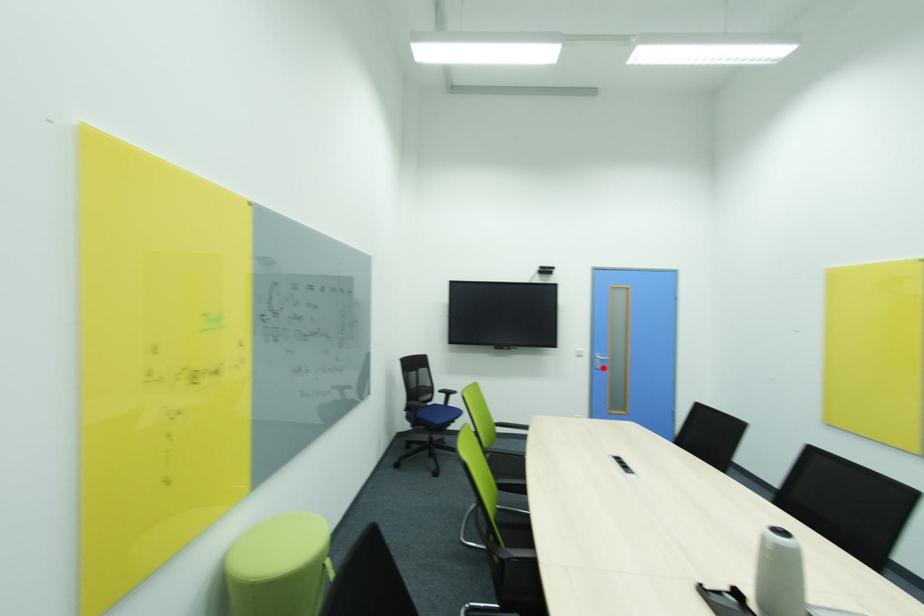
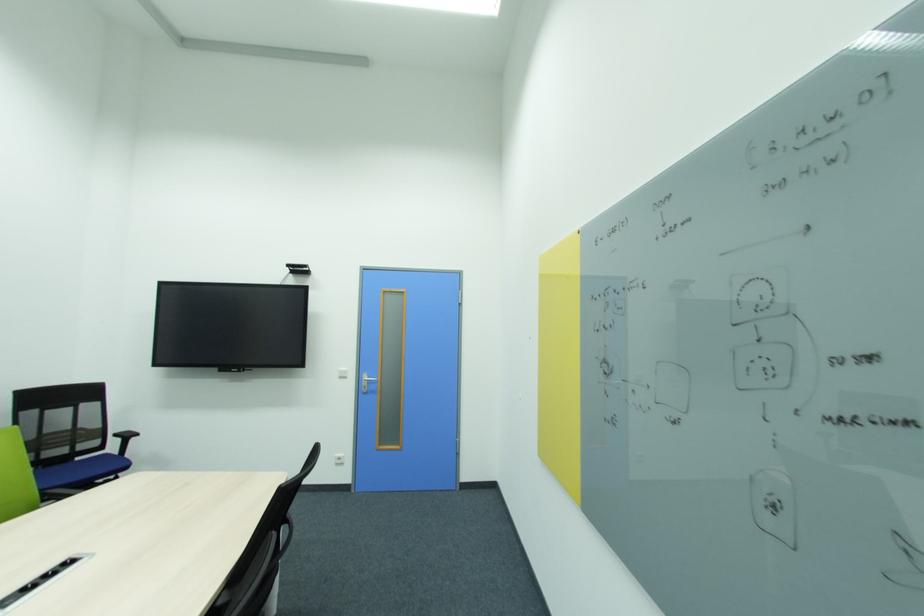
Find the pixel in the second image that matches the highlighted location in the first image.

(370, 392)